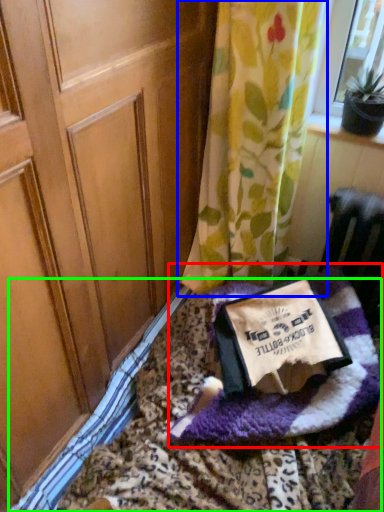
Question: Based on their relative distances, which object is nearer to blanket (highlighted by a red box)? Choose from curtain (highlighted by a blue box) and bedding (highlighted by a green box).

Choices:
 (A) curtain
 (B) bedding

Answer: (B)